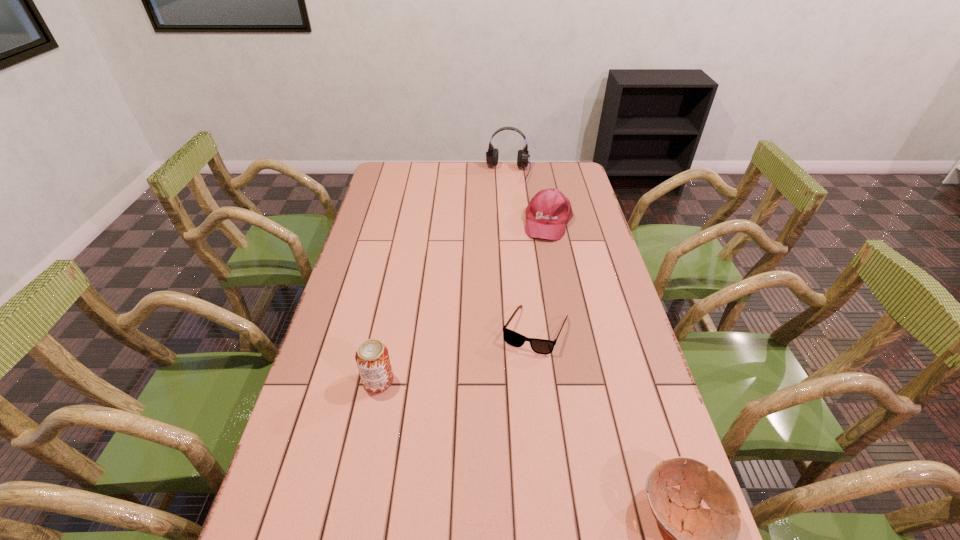
I want to click on the leftmost object, so click(372, 357).

At what (x,y) coordinates should I click in order to perform the action: click on the second nearest object. Please return your answer as a coordinate pair (x, y). Looking at the image, I should click on (372, 357).

The height and width of the screenshot is (540, 960). What are the coordinates of `the fourth nearest object` in the screenshot? It's located at (548, 212).

At what (x,y) coordinates should I click in order to perform the action: click on sunglasses. Please return your answer as a coordinate pair (x, y). This screenshot has height=540, width=960. Looking at the image, I should click on (541, 346).

This screenshot has width=960, height=540. Find the location of `the shortest object`. the shortest object is located at coordinates (541, 346).

The image size is (960, 540). What are the coordinates of `the tallest object` in the screenshot? It's located at (492, 154).

Identify the location of headset. This screenshot has width=960, height=540. (492, 154).

At what (x,y) coordinates should I click in order to perform the action: click on free location located 0.240m on the front of the leftmost object. Please return your answer as a coordinate pair (x, y). Looking at the image, I should click on (356, 490).

The height and width of the screenshot is (540, 960). What are the coordinates of `free space located at the front of the baseball cap with the brim` in the screenshot? It's located at (532, 301).

Find the location of a particular element. vacant space situated at the front of the baseball cap with the brim is located at coordinates (543, 254).